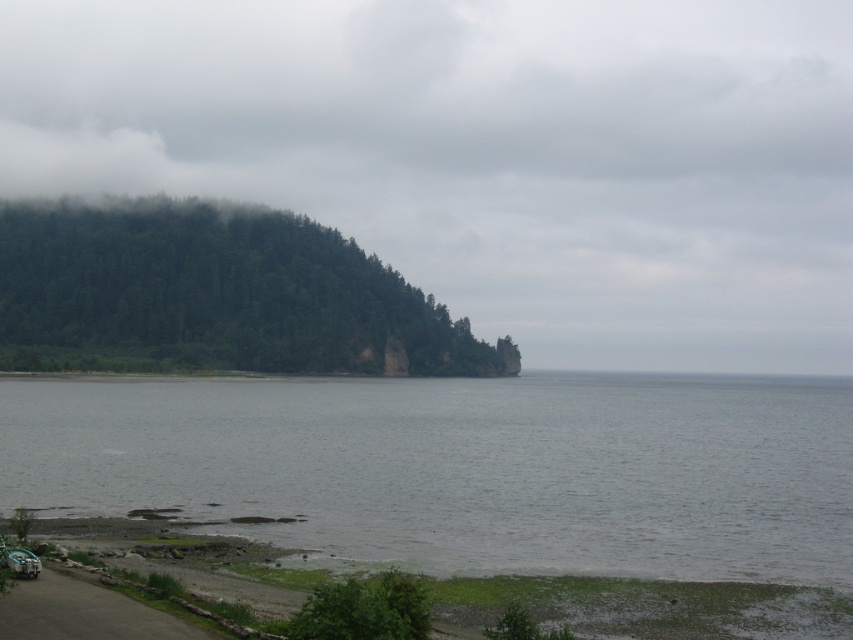
Question: Which object is the closest to the green forested hillside at upper left?

Choices:
 (A) green matte forest at upper left
 (B) gray water at lower left

Answer: (A)

Question: Is green forested hillside at upper left closer to the viewer compared to gray water at lower left?

Choices:
 (A) no
 (B) yes

Answer: (A)

Question: Is gray water at lower left wider than green leafy tree at lower center?

Choices:
 (A) no
 (B) yes

Answer: (B)

Question: Does green forested hillside at upper left have a lesser width compared to gray water at lower left?

Choices:
 (A) yes
 (B) no

Answer: (B)

Question: Which object is farther from the camera taking this photo?

Choices:
 (A) green matte forest at upper left
 (B) green forested hillside at upper left
 (C) green leafy tree at lower center
 (D) gray water at lower left

Answer: (B)

Question: Which of the following is the closest to the observer?

Choices:
 (A) pos(12,282)
 (B) pos(395,598)

Answer: (B)